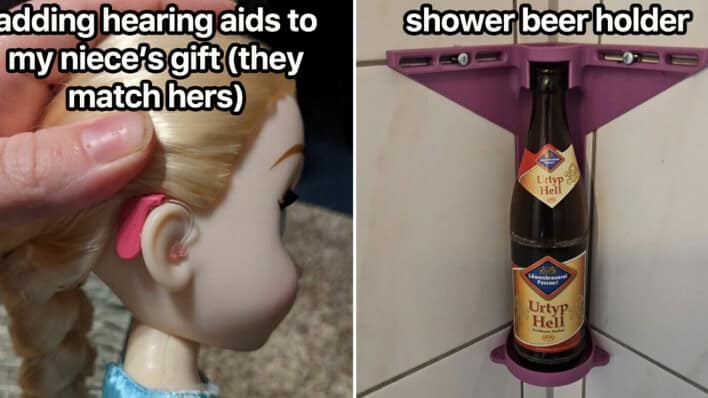
Find the location of a particular element. The image size is (708, 398). shower walls is located at coordinates (663, 225), (439, 212).